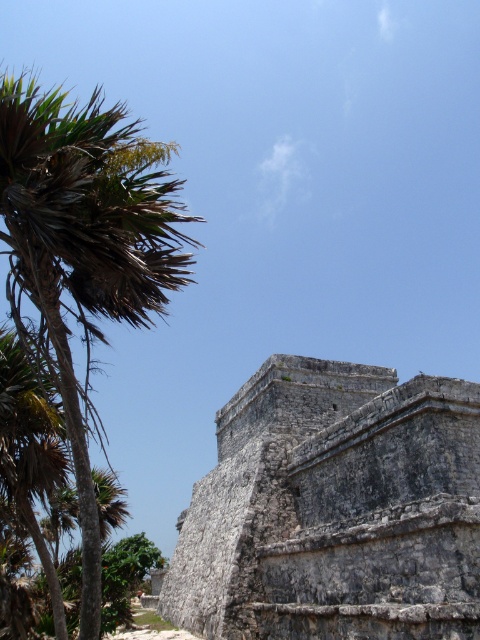
You are standing in front of the gray stone ruins at center and want to take a photo of the green leafy palm at left. Which direction should you face to capture the palm in your shot?

You should face to the left of the gray stone ruins at center to capture the green leafy palm at left in your photo, since the gray stone ruins at center are located to the right of the green leafy palm at left.

You are standing at the origin point in the image and want to take a photo of the gray stone ruins at center. According to the coordinates provided, in which direction should you move to face the ruins?

The gray stone ruins at center is located at point (335, 509), which means it is to the northeast of your current position. You should move northeast to face the ruins.